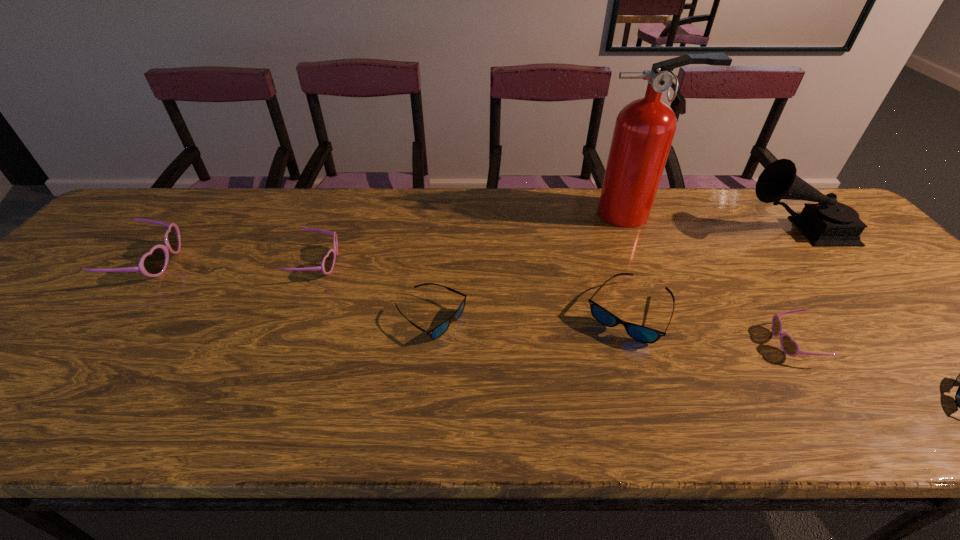
This screenshot has height=540, width=960. I want to click on fire extinguisher, so click(x=644, y=130).

Find the location of `phonograph_record`. phonograph_record is located at coordinates (828, 223).

Identify the location of black phonograph_record. (828, 223).

Where is `the leftmost sunglasses`? This screenshot has height=540, width=960. the leftmost sunglasses is located at coordinates (153, 263).

This screenshot has width=960, height=540. I want to click on the leftmost pink sunglasses, so click(x=153, y=263).

Image resolution: width=960 pixels, height=540 pixels. I want to click on the second pink sunglasses from right to left, so click(328, 262).

Where is `the second sunglasses from left to right`? This screenshot has width=960, height=540. the second sunglasses from left to right is located at coordinates [328, 262].

Locate an element on the screen. the fourth sunglasses from left to right is located at coordinates (640, 333).

Identify the location of the second blue sunglasses from right to left. (640, 333).

Identify the location of the sixth object from left to right. (790, 347).